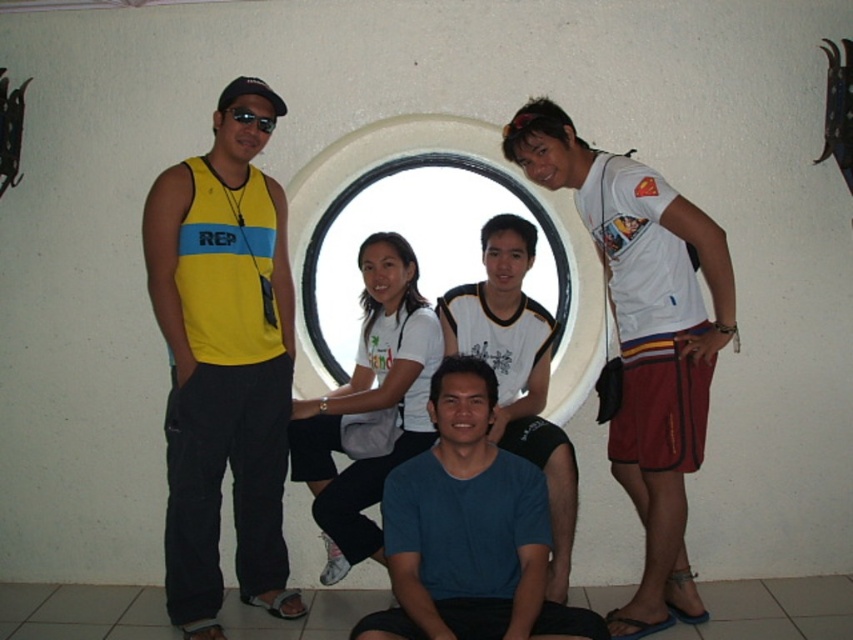
You are standing at the origin point of the image. You want to walk towards the point labeled as point (550, 330). However, there is an obstacle at point (251, 113). Will you encounter the obstacle before reaching your destination?

Yes, you will encounter the obstacle at point (251, 113) before reaching point (550, 330) because point (550, 330) is behind point (251, 113).

You are a photographer trying to adjust the lighting for a photo shoot. You notice the yellow fabric tank top at left and the blue cotton shirt at center. Which clothing item might require more space in the frame to avoid being cut off?

The yellow fabric tank top at left might be wider than the blue cotton shirt at center, so it could require more space in the frame to avoid being cut off.

You are a photographer trying to adjust the lighting for a photo shoot. You notice two shirts in the scene, the yellow fabric tank top at left and the blue matte shirt at center. Which shirt should you focus on to ensure proper exposure, considering their positions and sizes?

The yellow fabric tank top at left has a greater height compared to the blue matte shirt at center, so focusing on the larger yellow fabric tank top at left would ensure proper exposure since it occupies more space in the frame.